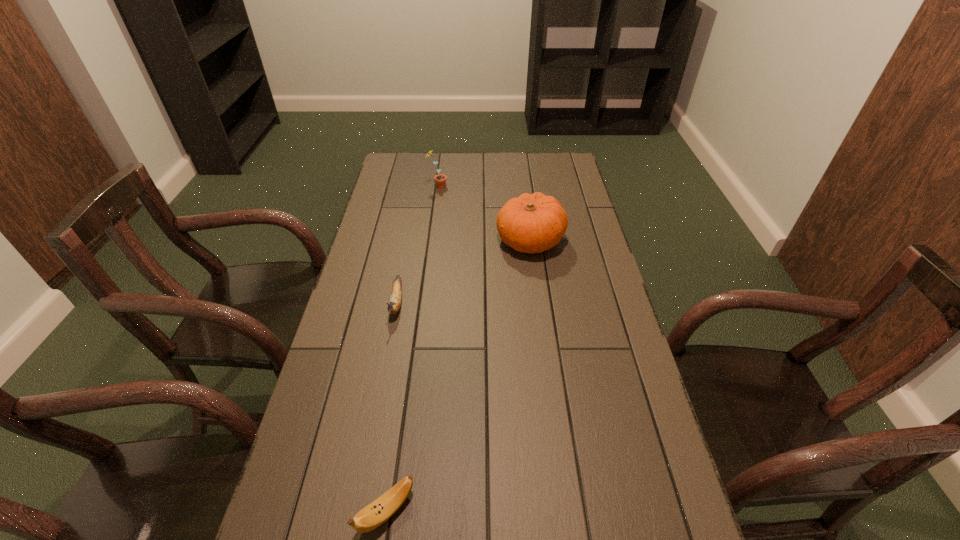
Where is `free location that satisfies the following two spatial constraints: 1. on the flower of the sunflower; 2. on the peel of the farther banana`? This screenshot has height=540, width=960. free location that satisfies the following two spatial constraints: 1. on the flower of the sunflower; 2. on the peel of the farther banana is located at coordinates (422, 303).

Find the location of a particular element. Image resolution: width=960 pixels, height=540 pixels. free point that satisfies the following two spatial constraints: 1. on the flower of the sunflower; 2. on the right side of the pumpkin is located at coordinates (430, 241).

Find the location of a particular element. This screenshot has height=540, width=960. vacant area in the image that satisfies the following two spatial constraints: 1. on the flower of the rightmost object; 2. on the right side of the sunflower is located at coordinates (430, 241).